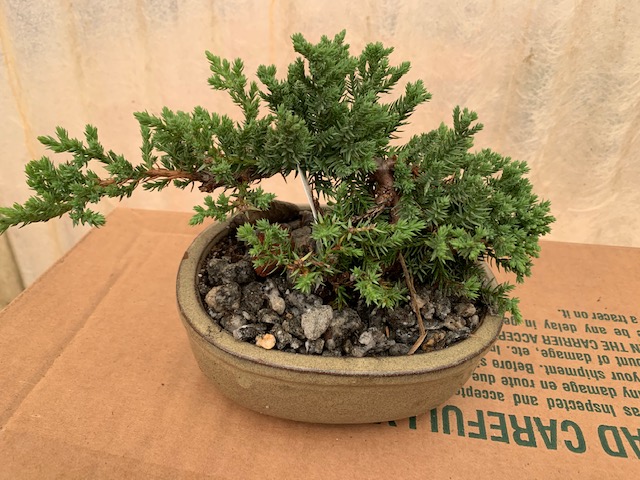
Where is `pot`? The image size is (640, 480). pot is located at coordinates (420, 389).